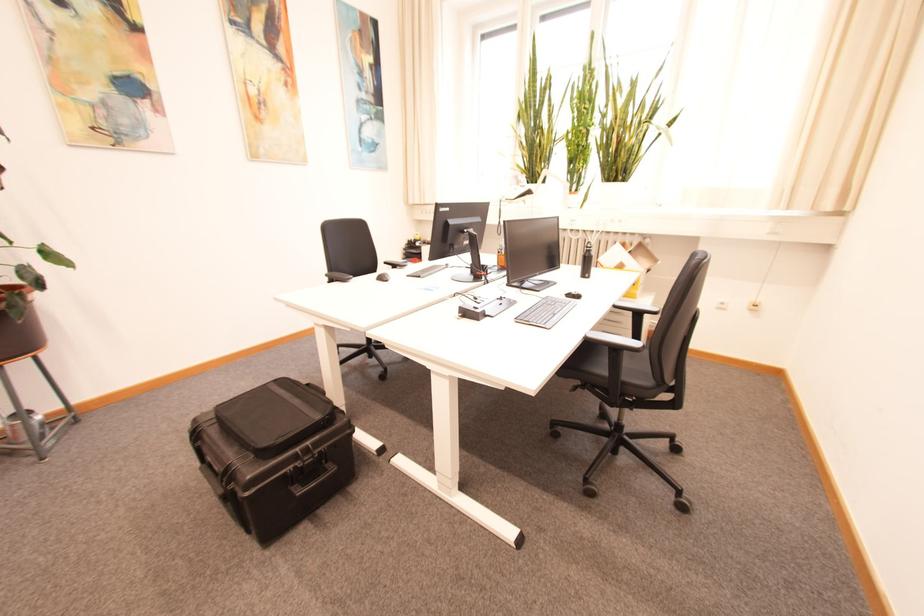
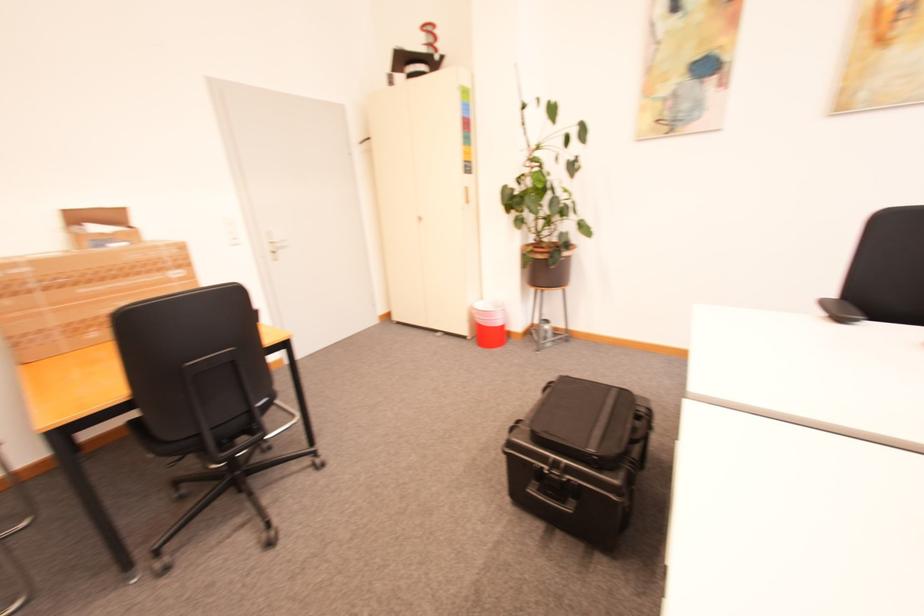
In the second image, find the point that corresponds to point 305,495 in the first image.

(535, 492)